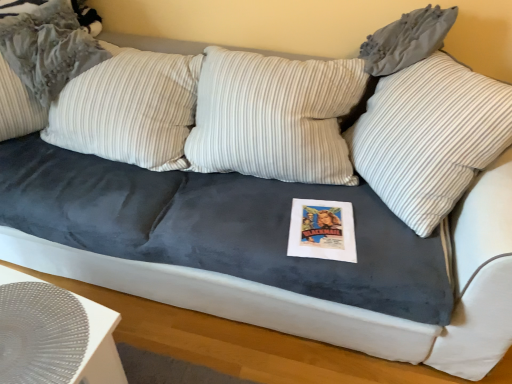
Question: From the image's perspective, is striped fabric pillow at upper left, the 2th pillow from the right, located above or below white striped pillow at upper center, the second pillow when ordered from left to right?

Choices:
 (A) above
 (B) below

Answer: (A)

Question: Is striped fabric pillow at upper left, the 2th pillow from the right, wider or thinner than white striped pillow at upper center, the second pillow when ordered from left to right?

Choices:
 (A) wide
 (B) thin

Answer: (B)

Question: Estimate the real-world distances between objects in this image. Which object is closer to the white striped pillow at upper center, the second pillow when ordered from left to right?

Choices:
 (A) white textured placemat at lower left
 (B) striped fabric pillow at upper left, the 2th pillow from the right

Answer: (A)

Question: Which object is the closest to the white striped pillow at upper center, the 1th pillow when ordered from right to left?

Choices:
 (A) white textured placemat at lower left
 (B) striped fabric pillow at upper left, the 2th pillow from the right

Answer: (A)